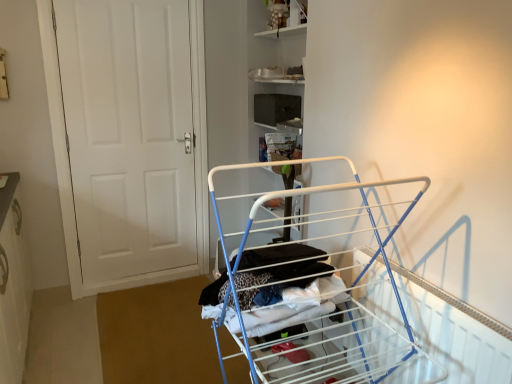
Question: Should I look upward or downward to see white metal drying rack at center?

Choices:
 (A) down
 (B) up

Answer: (A)

Question: Does white matte door at left appear on the right side of metallic silver shelf at upper center?

Choices:
 (A) no
 (B) yes

Answer: (A)

Question: Would you consider white matte door at left to be distant from metallic silver shelf at upper center?

Choices:
 (A) yes
 (B) no

Answer: (A)

Question: Is white matte door at left thinner than metallic silver shelf at upper center?

Choices:
 (A) no
 (B) yes

Answer: (B)

Question: From the image's perspective, does white matte door at left appear lower than metallic silver shelf at upper center?

Choices:
 (A) yes
 (B) no

Answer: (A)

Question: From the image's perspective, is white matte door at left over metallic silver shelf at upper center?

Choices:
 (A) yes
 (B) no

Answer: (B)

Question: Considering the relative sizes of white matte door at left and metallic silver shelf at upper center in the image provided, is white matte door at left shorter than metallic silver shelf at upper center?

Choices:
 (A) yes
 (B) no

Answer: (B)

Question: Does white metal drying rack at center have a smaller size compared to metallic silver shelf at upper center?

Choices:
 (A) no
 (B) yes

Answer: (A)

Question: Is white metal drying rack at center to the left of metallic silver shelf at upper center from the viewer's perspective?

Choices:
 (A) no
 (B) yes

Answer: (A)

Question: From the image's perspective, is white metal drying rack at center on metallic silver shelf at upper center?

Choices:
 (A) yes
 (B) no

Answer: (B)

Question: Is white metal drying rack at center taller than metallic silver shelf at upper center?

Choices:
 (A) no
 (B) yes

Answer: (B)

Question: Can you confirm if white metal drying rack at center is shorter than metallic silver shelf at upper center?

Choices:
 (A) yes
 (B) no

Answer: (B)

Question: Is white metal drying rack at center located outside metallic silver shelf at upper center?

Choices:
 (A) no
 (B) yes

Answer: (B)

Question: From the image's perspective, does metallic silver shelf at upper center appear lower than white matte door at left?

Choices:
 (A) no
 (B) yes

Answer: (A)